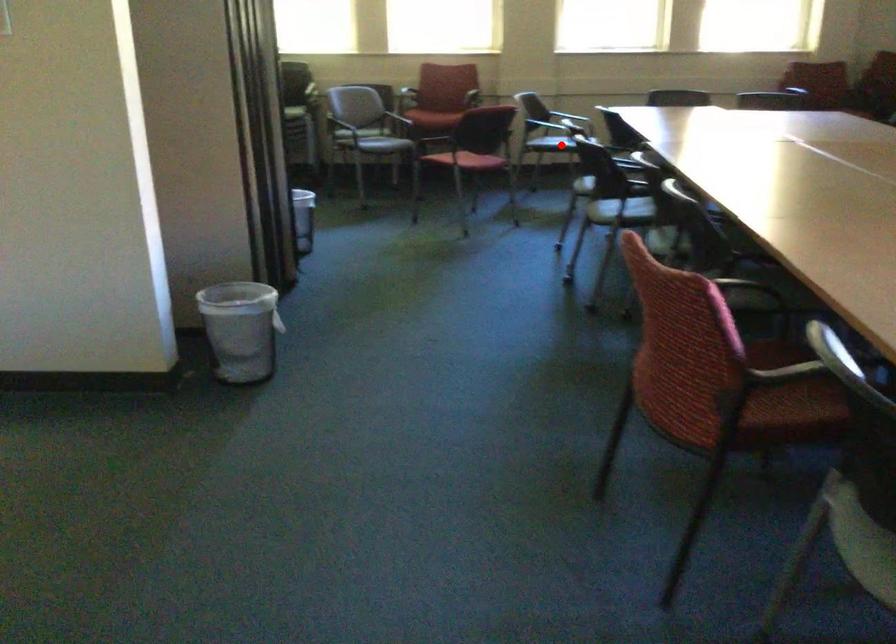
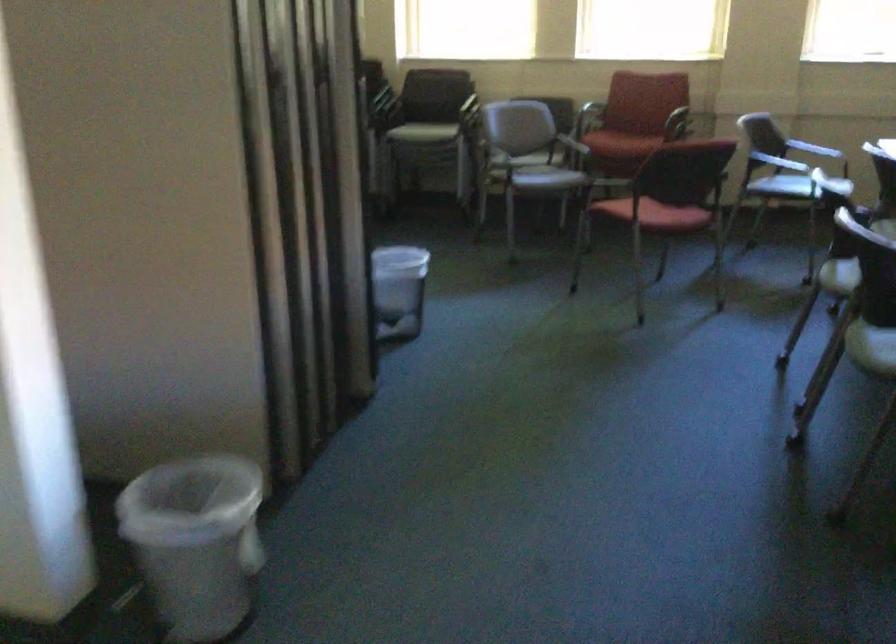
Locate, in the second image, the point that corresponds to the highlighted location in the first image.

(781, 185)